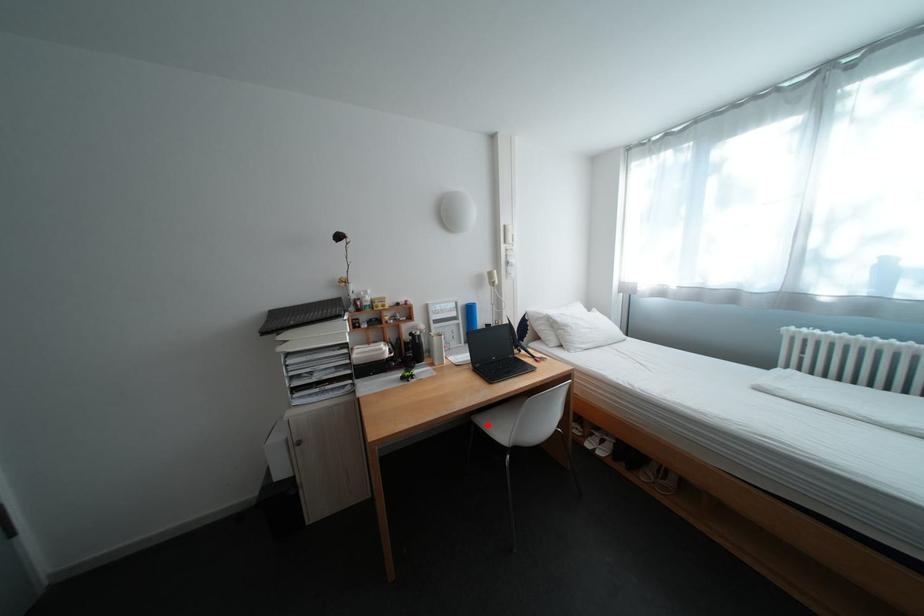
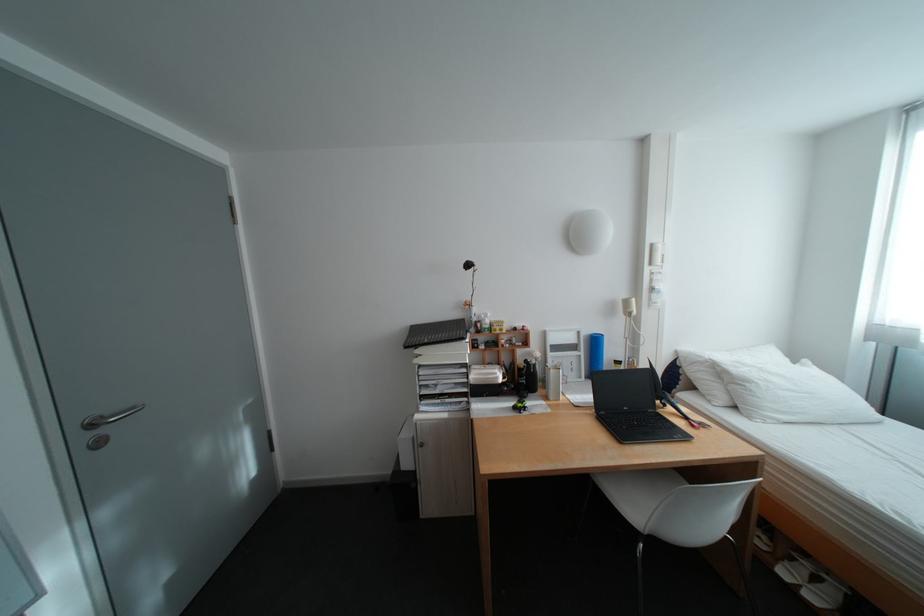
Question: I am providing you with two images of the same scene from different viewpoints. A red point is marked on the first image. At the location where the point appears in image 1, is it still visible in image 2?

Choices:
 (A) Yes
 (B) No

Answer: (A)